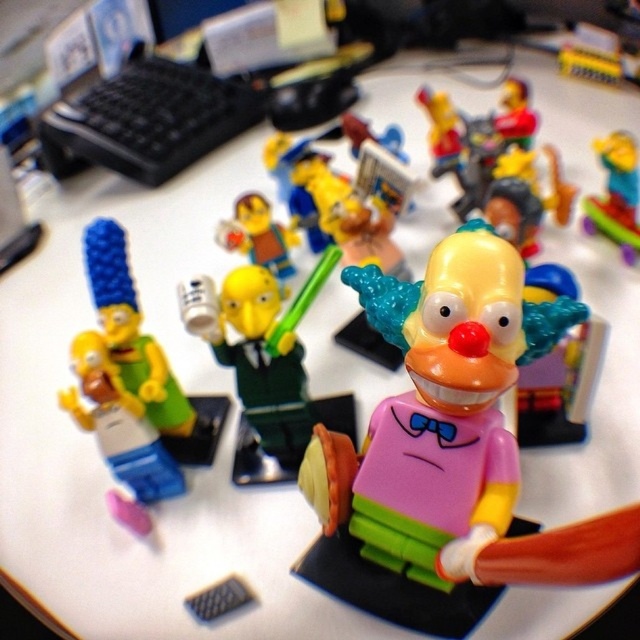
You are a photographer trying to capture a closeup of the clown figurine. You notice two points marked in the image, point 1 at coordinates point (250, 285) and point 2 at coordinates point (627, 157). Which point should you focus on to get the clown figurine in focus?

Point (250, 285) is closer to the camera than point (627, 157), so focusing on point (250, 285) will ensure the clown figurine is in focus.

You are setting up a display for a party and have the pink matte clown at center and the green plastic mug at center. If you want to arrange them side by side on a shelf that can only accommodate items up to the width of the wider object, which object should you use to determine the minimum shelf width?

The pink matte clown at center is wider than the green plastic mug at center, so the shelf width should be at least the width of the pink matte clown at center to accommodate both items.

You are arranging LEGO figurines on a desk and want to place a new accessory exactly where the pink matte clown at center is currently positioned. According to the coordinates provided, where should you place the new accessory?

The new accessory should be placed at the coordinates point (x=436, y=404) where the pink matte clown at center is located.